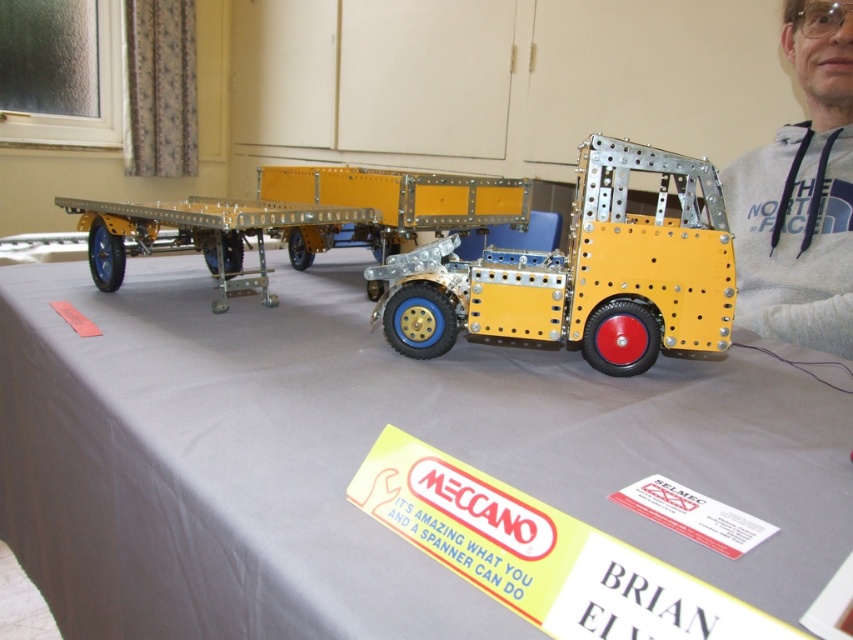
Between point (726, 428) and point (453, 266), which one is positioned behind?

Point (453, 266)

From the picture: Is gray fabric at center below yellow metallic truck at center?

Indeed, gray fabric at center is positioned under yellow metallic truck at center.

Between point (759, 488) and point (628, 275), which one is positioned in front?

Point (759, 488)

Where is `gray fabric at center`? gray fabric at center is located at coordinates (358, 458).

Looking at this image, is gray fleece hoodie at upper right bigger than metallic yellow trailer truck at center?

No, gray fleece hoodie at upper right is not bigger than metallic yellow trailer truck at center.

Does gray fleece hoodie at upper right come in front of metallic yellow trailer truck at center?

No, it is behind metallic yellow trailer truck at center.

Is point (756, 221) positioned after point (416, 186)?

Yes.

Locate an element on the screen. gray fleece hoodie at upper right is located at coordinates 799,195.

How far apart are yellow metallic truck at center and metallic yellow trailer truck at center?

They are 43.90 centimeters apart.

Does yellow metallic truck at center have a lesser height compared to metallic yellow trailer truck at center?

Indeed, yellow metallic truck at center has a lesser height compared to metallic yellow trailer truck at center.

What are the coordinates of `yellow metallic truck at center` in the screenshot? It's located at pos(583,273).